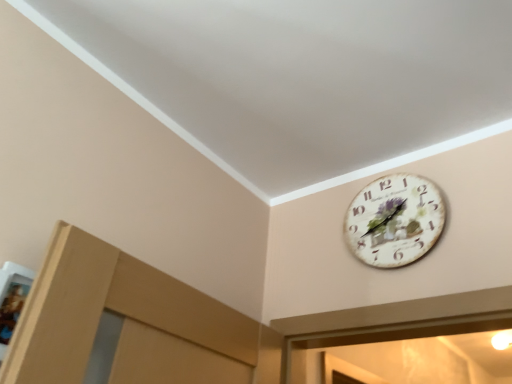
The image size is (512, 384). What do you see at coordinates (394, 220) in the screenshot? I see `white painted wood wall clock at upper right` at bounding box center [394, 220].

Where is `white painted wood wall clock at upper right`? This screenshot has width=512, height=384. white painted wood wall clock at upper right is located at coordinates (394, 220).

Where is `white painted wood wall clock at upper right`? Image resolution: width=512 pixels, height=384 pixels. white painted wood wall clock at upper right is located at coordinates (394, 220).